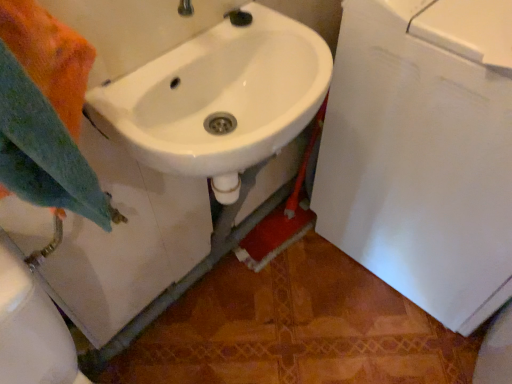
Question: Is orange fabric towel at left a part of white glossy sink at center?

Choices:
 (A) yes
 (B) no

Answer: (B)

Question: Is white glossy sink at center oriented away from orange fabric towel at left?

Choices:
 (A) no
 (B) yes

Answer: (A)

Question: From a real-world perspective, is white glossy sink at center on orange fabric towel at left?

Choices:
 (A) yes
 (B) no

Answer: (B)

Question: Is white glossy sink at center not near orange fabric towel at left?

Choices:
 (A) no
 (B) yes

Answer: (A)

Question: From the image's perspective, is white glossy sink at center on top of orange fabric towel at left?

Choices:
 (A) no
 (B) yes

Answer: (B)

Question: Considering the relative sizes of white glossy sink at center and orange fabric towel at left in the image provided, is white glossy sink at center smaller than orange fabric towel at left?

Choices:
 (A) yes
 (B) no

Answer: (B)

Question: From the image's perspective, does orange fabric towel at left appear higher than white glossy sink at center?

Choices:
 (A) no
 (B) yes

Answer: (A)

Question: Considering the relative positions of orange fabric towel at left and white glossy sink at center in the image provided, is orange fabric towel at left to the right of white glossy sink at center from the viewer's perspective?

Choices:
 (A) no
 (B) yes

Answer: (A)

Question: Is white glossy sink at center at the back of orange fabric towel at left?

Choices:
 (A) no
 (B) yes

Answer: (A)

Question: Is the surface of orange fabric towel at left in direct contact with white glossy sink at center?

Choices:
 (A) no
 (B) yes

Answer: (A)

Question: Is there a large distance between orange fabric towel at left and white glossy sink at center?

Choices:
 (A) no
 (B) yes

Answer: (A)

Question: Can you confirm if orange fabric towel at left is positioned to the left of white glossy sink at center?

Choices:
 (A) yes
 (B) no

Answer: (A)

Question: From a real-world perspective, is orange fabric towel at left physically located above or below white glossy sink at center?

Choices:
 (A) below
 (B) above

Answer: (B)